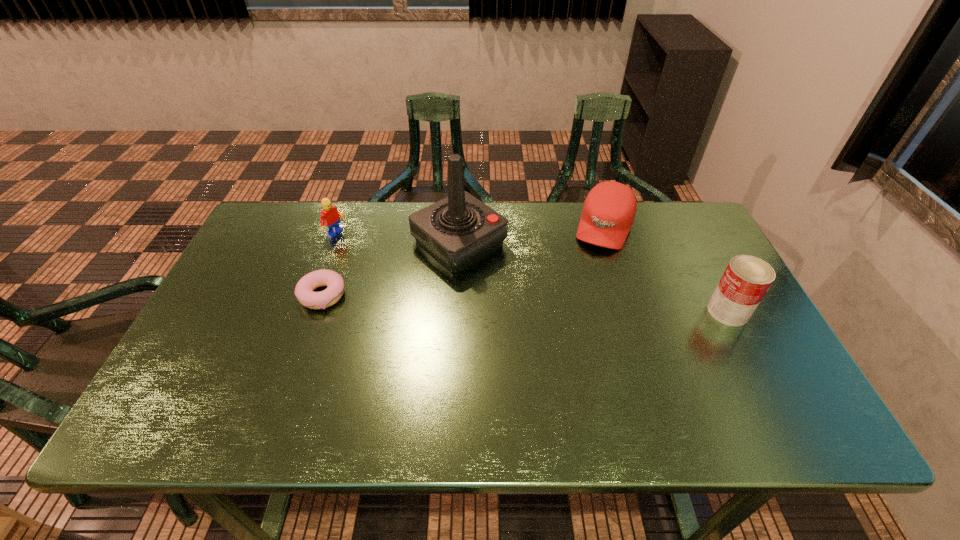
Image resolution: width=960 pixels, height=540 pixels. Identify the location of vacant space on the desktop that is between the shortest object and the fourth shortest object and is positioned on the front-facing side of the cap. (575, 306).

In order to click on free spot on the desktop that is between the doughnut and the can and is positioned on the front-facing side of the third object from left to right in this screenshot , I will do `click(537, 304)`.

Find the location of a particular element. Image resolution: width=960 pixels, height=540 pixels. vacant space on the desktop that is between the doughnut and the second tallest object and is positioned on the front-facing side of the Lego is located at coordinates (464, 301).